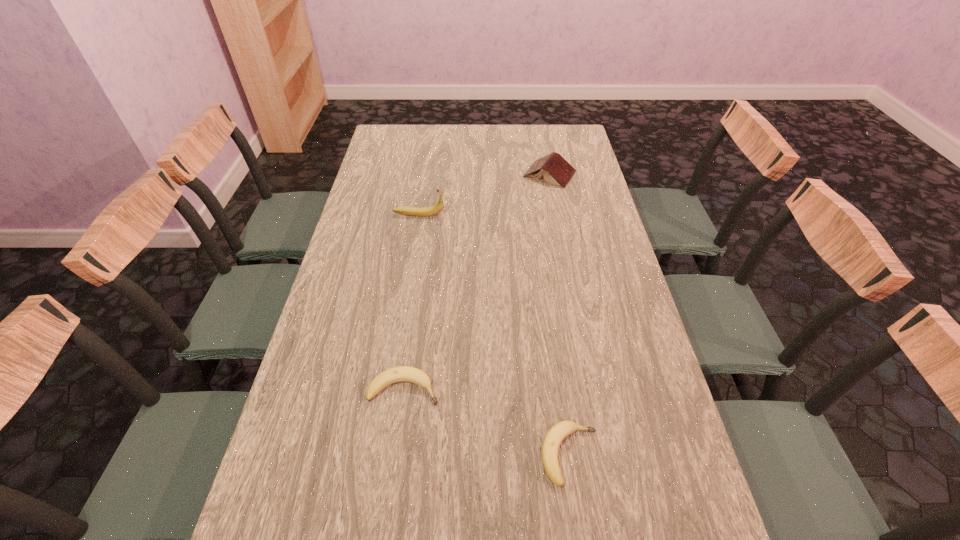
Locate an element on the screen. vacant point located between the farthest object and the third farthest object is located at coordinates (477, 281).

Image resolution: width=960 pixels, height=540 pixels. I want to click on free space between the tallest object and the nearest object, so click(x=494, y=335).

Find the location of a particular element. The height and width of the screenshot is (540, 960). free space between the farthest banana and the nearest banana is located at coordinates (494, 335).

Find the location of a particular element. Image resolution: width=960 pixels, height=540 pixels. vacant space in between the second farthest banana and the tallest object is located at coordinates (412, 301).

Image resolution: width=960 pixels, height=540 pixels. I want to click on blank region between the tallest object and the third farthest object, so click(x=412, y=301).

Find the location of a particular element. vacant space in between the second farthest banana and the farthest object is located at coordinates (477, 281).

Locate an element on the screen. This screenshot has height=540, width=960. vacant area that lies between the farthest object and the nearest object is located at coordinates (560, 315).

Select which object is the closest to the second nearest banana. Please provide its 2D coordinates. Your answer should be formatted as a tuple, i.e. [(x, y)], where the tuple contains the x and y coordinates of a point satisfying the conditions above.

[(555, 436)]

Select which object is the closest to the second nearest banana. Please provide its 2D coordinates. Your answer should be formatted as a tuple, i.e. [(x, y)], where the tuple contains the x and y coordinates of a point satisfying the conditions above.

[(555, 436)]

At what (x,y) coordinates should I click in order to perform the action: click on the closest banana to the nearest banana. Please return your answer as a coordinate pair (x, y). This screenshot has width=960, height=540. Looking at the image, I should click on (401, 373).